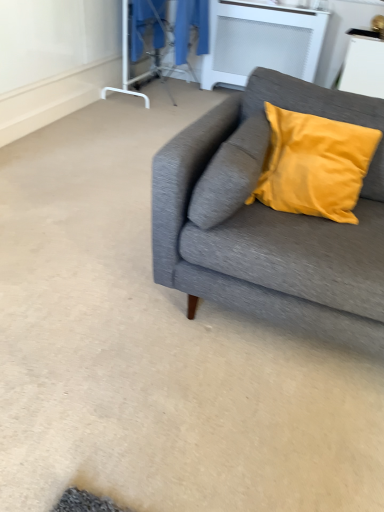
Question: Would you say white glossy table at upper right, which appears as the 2th table when viewed from the back, is to the left or to the right of textured gray couch at right in the picture?

Choices:
 (A) right
 (B) left

Answer: (A)

Question: Considering the positions of white glossy table at upper right, arranged as the first table when viewed from the right, and textured gray couch at right in the image, is white glossy table at upper right, arranged as the first table when viewed from the right, wider or thinner than textured gray couch at right?

Choices:
 (A) thin
 (B) wide

Answer: (A)

Question: Considering the real-world distances, which object is farthest from the textured gray couch at right?

Choices:
 (A) white glossy table at upper right, positioned as the second table in left-to-right order
 (B) transparent plastic screen door at upper center
 (C) blue fabric laundry at upper center
 (D) white matte radiator at upper center, which is counted as the 1th table, starting from the left

Answer: (B)

Question: Which is farther from the textured gray couch at right?

Choices:
 (A) white matte radiator at upper center, which is the 2th table from front to back
 (B) blue fabric laundry at upper center
 (C) transparent plastic screen door at upper center
 (D) white glossy table at upper right, positioned as the second table in left-to-right order

Answer: (C)